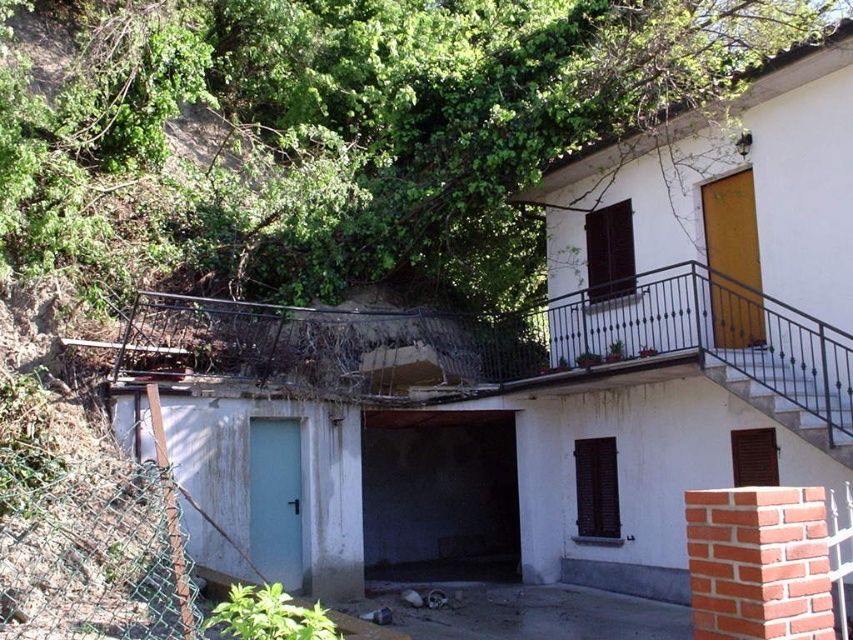
Does green leafy tree at upper left appear under green chain-link fence at lower left?

Incorrect, green leafy tree at upper left is not positioned below green chain-link fence at lower left.

Is green leafy tree at upper left to the left of green chain-link fence at lower left from the viewer's perspective?

No, green leafy tree at upper left is not to the left of green chain-link fence at lower left.

Identify the location of green leafy tree at upper left. (347, 129).

The height and width of the screenshot is (640, 853). I want to click on green leafy tree at upper left, so click(x=347, y=129).

Between green chain-link fence at lower left and white painted wood stairs at center, which one has less height?

white painted wood stairs at center

Is green chain-link fence at lower left bigger than white painted wood stairs at center?

Indeed, green chain-link fence at lower left has a larger size compared to white painted wood stairs at center.

Where is `green chain-link fence at lower left`? This screenshot has width=853, height=640. green chain-link fence at lower left is located at coordinates (94, 557).

Is green leafy tree at upper left to the left of white painted wood stairs at center from the viewer's perspective?

Yes, green leafy tree at upper left is to the left of white painted wood stairs at center.

Is green leafy tree at upper left smaller than white painted wood stairs at center?

Incorrect, green leafy tree at upper left is not smaller in size than white painted wood stairs at center.

Is point (242, 115) less distant than point (811, 442)?

No, (242, 115) is behind (811, 442).

Where is `green leafy tree at upper left`? green leafy tree at upper left is located at coordinates pos(347,129).